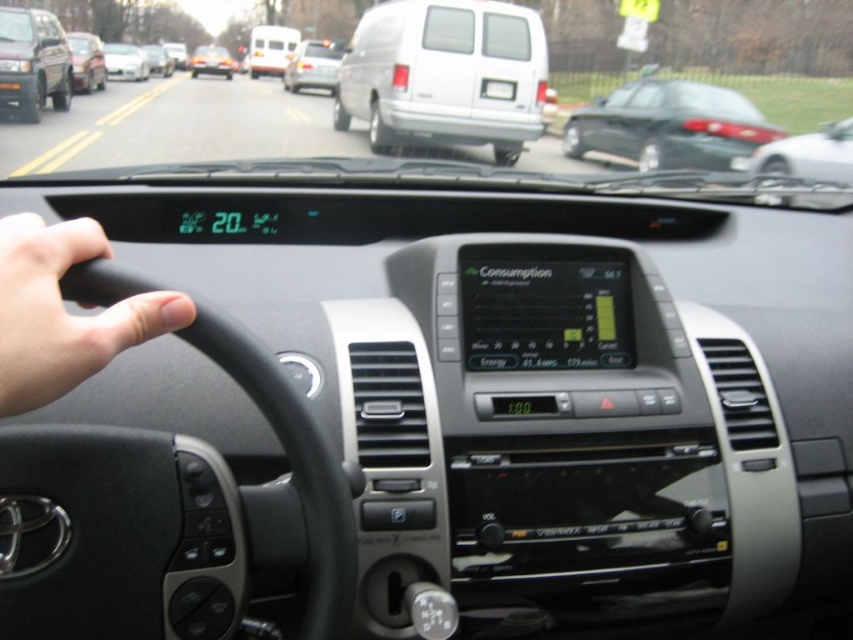
Which of these two, black rubber steering wheel at left or metallic silver sedan at left, stands taller?

Standing taller between the two is metallic silver sedan at left.

Who is higher up, black rubber steering wheel at left or metallic silver sedan at left?

Positioned higher is metallic silver sedan at left.

The height and width of the screenshot is (640, 853). What do you see at coordinates (62, 312) in the screenshot?
I see `black rubber steering wheel at left` at bounding box center [62, 312].

This screenshot has width=853, height=640. In order to click on black rubber steering wheel at left in this screenshot , I will do `click(62, 312)`.

Who is shorter, matte black van at left or matte black sedan at center?

With less height is matte black van at left.

Is matte black van at left to the left of matte black sedan at center from the viewer's perspective?

No, matte black van at left is not to the left of matte black sedan at center.

This screenshot has width=853, height=640. Find the location of `matte black van at left`. matte black van at left is located at coordinates (33, 61).

Locate an element on the screen. matte black van at left is located at coordinates (33, 61).

Can you confirm if black rubber steering wheel at left is smaller than metallic silver car at right?

Yes, black rubber steering wheel at left is smaller than metallic silver car at right.

Can you confirm if black rubber steering wheel at left is wider than metallic silver car at right?

In fact, black rubber steering wheel at left might be narrower than metallic silver car at right.

Which is in front, point (20, 323) or point (833, 154)?

Positioned in front is point (20, 323).

You are a GUI agent. You are given a task and a screenshot of the screen. Output one action in this format:
    pyautogui.click(x=<x>, y=<y>)
    Task: Click on the black rubber steering wheel at left
    
    Given the screenshot: What is the action you would take?
    pyautogui.click(x=62, y=312)